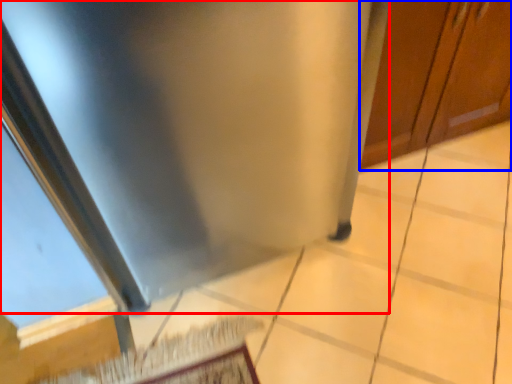
Question: Among these objects, which one is farthest to the camera, stainless steel (highlighted by a red box) or door (highlighted by a blue box)?

Choices:
 (A) stainless steel
 (B) door

Answer: (B)